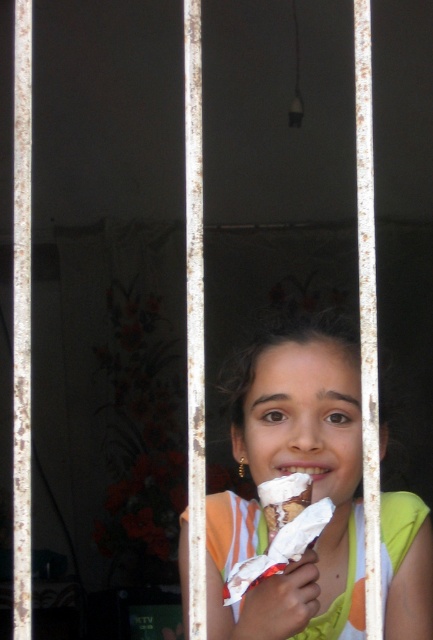
Question: Based on their relative distances, which object is nearer to the matte white ice cream cone at center?

Choices:
 (A) white creamy ice cream cone at center
 (B) yellow fabric safety vest at center

Answer: (B)

Question: Which point is closer to the camera?

Choices:
 (A) matte white ice cream cone at center
 (B) white creamy ice cream cone at center
 (C) yellow fabric safety vest at center

Answer: (A)

Question: Can you confirm if yellow fabric safety vest at center is positioned to the left of white creamy ice cream cone at center?

Choices:
 (A) no
 (B) yes

Answer: (B)

Question: Observing the image, what is the correct spatial positioning of matte white ice cream cone at center in reference to white creamy ice cream cone at center?

Choices:
 (A) above
 (B) below

Answer: (B)

Question: Can you confirm if yellow fabric safety vest at center is positioned above white creamy ice cream cone at center?

Choices:
 (A) yes
 (B) no

Answer: (B)

Question: Which is farther from the white creamy ice cream cone at center?

Choices:
 (A) yellow fabric safety vest at center
 (B) matte white ice cream cone at center

Answer: (A)